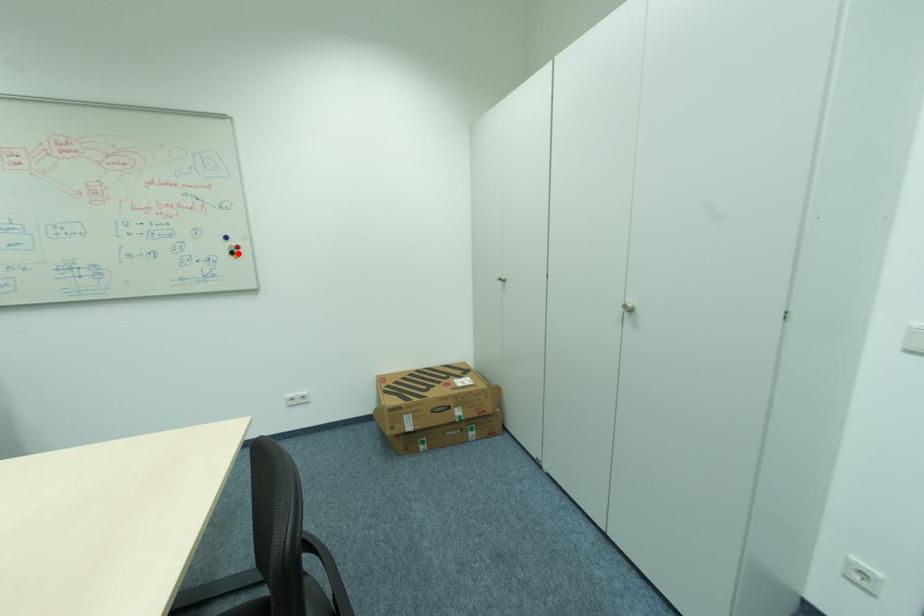
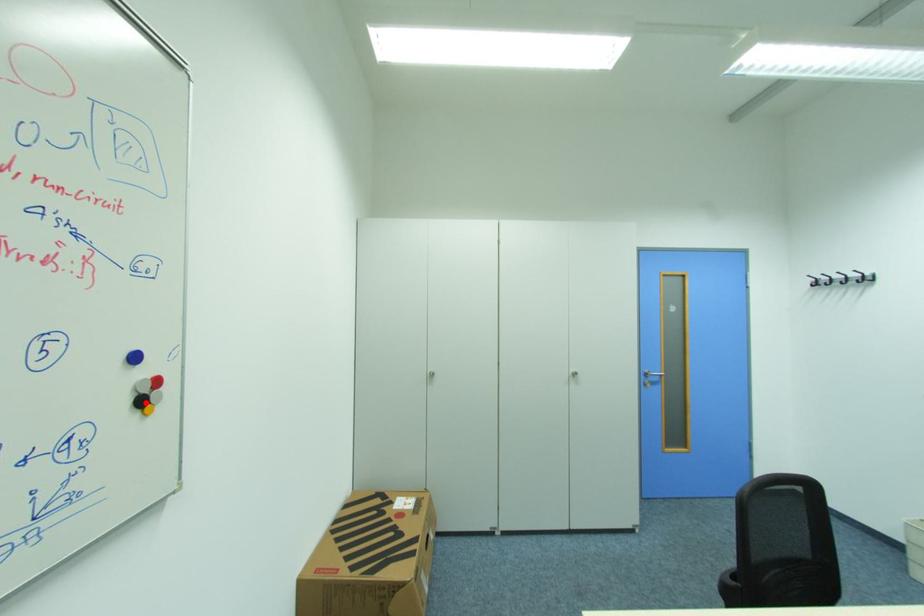
I am providing you with two images of the same scene from different viewpoints. A red point is marked on the first image and another point is marked on the second image. Is the red point in image1 aligned with the point shown in image2?

Yes